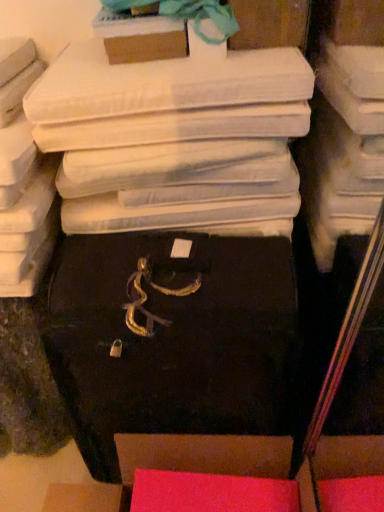
Question: Is matte cardboard box at upper center, the 2th storage box when ordered from top to bottom, in front of or behind matte pink box at lower center, marked as the first storage box in a bottom-to-top arrangement, in the image?

Choices:
 (A) front
 (B) behind

Answer: (B)

Question: Is matte cardboard box at upper center, the 2th storage box when ordered from top to bottom, inside the boundaries of matte pink box at lower center, acting as the 4th storage box starting from the top, or outside?

Choices:
 (A) outside
 (B) inside

Answer: (A)

Question: Estimate the real-world distances between objects in this image. Which object is farther from the black matte suitcase at center, the third storage box in the top-to-bottom sequence?

Choices:
 (A) matte white storage box at upper center, which appears as the 1th storage box when viewed from the top
 (B) matte pink box at lower center, acting as the 4th storage box starting from the top
 (C) matte cardboard box at upper center, the 2th storage box when ordered from top to bottom

Answer: (A)

Question: Estimate the real-world distances between objects in this image. Which object is closer to the matte white storage box at upper center, which is counted as the 4th storage box, starting from the bottom?

Choices:
 (A) matte cardboard box at upper center, the 2th storage box when ordered from top to bottom
 (B) black matte suitcase at center, which appears as the second storage box when ordered from the bottom
 (C) matte pink box at lower center, acting as the 4th storage box starting from the top

Answer: (A)